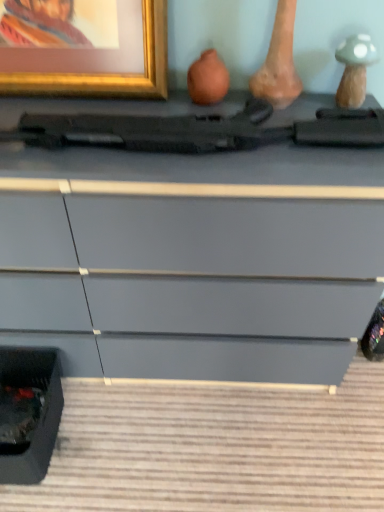
Question: Can you confirm if gold metallic picture frame at upper left is positioned to the right of matte black gun at center?

Choices:
 (A) no
 (B) yes

Answer: (A)

Question: Can you confirm if gold metallic picture frame at upper left is wider than matte black gun at center?

Choices:
 (A) no
 (B) yes

Answer: (A)

Question: Is gold metallic picture frame at upper left placed right next to matte black gun at center?

Choices:
 (A) yes
 (B) no

Answer: (B)

Question: From the image's perspective, would you say gold metallic picture frame at upper left is positioned over matte black gun at center?

Choices:
 (A) no
 (B) yes

Answer: (B)

Question: From the image's perspective, is gold metallic picture frame at upper left below matte black gun at center?

Choices:
 (A) yes
 (B) no

Answer: (B)

Question: From the image's perspective, is matte gray chest of drawers at center positioned above or below gold metallic picture frame at upper left?

Choices:
 (A) below
 (B) above

Answer: (A)

Question: Considering the positions of matte gray chest of drawers at center and gold metallic picture frame at upper left in the image, is matte gray chest of drawers at center bigger or smaller than gold metallic picture frame at upper left?

Choices:
 (A) small
 (B) big

Answer: (B)

Question: Is matte gray chest of drawers at center taller or shorter than gold metallic picture frame at upper left?

Choices:
 (A) tall
 (B) short

Answer: (A)

Question: Choose the correct answer: Is matte gray chest of drawers at center inside gold metallic picture frame at upper left or outside it?

Choices:
 (A) inside
 (B) outside

Answer: (B)

Question: In terms of size, does matte gray chest of drawers at center appear bigger or smaller than matte black gun at center?

Choices:
 (A) small
 (B) big

Answer: (B)

Question: Is point (178, 242) positioned closer to the camera than point (213, 131)?

Choices:
 (A) closer
 (B) farther

Answer: (B)

Question: In the image, is matte gray chest of drawers at center positioned in front of or behind matte black gun at center?

Choices:
 (A) front
 (B) behind

Answer: (A)

Question: From a real-world perspective, relative to matte black gun at center, is matte gray chest of drawers at center vertically above or below?

Choices:
 (A) below
 (B) above

Answer: (A)

Question: Considering the positions of point (26, 44) and point (195, 176), is point (26, 44) closer or farther from the camera than point (195, 176)?

Choices:
 (A) closer
 (B) farther

Answer: (B)

Question: From the image's perspective, relative to matte gray chest of drawers at center, is gold metallic picture frame at upper left above or below?

Choices:
 (A) below
 (B) above

Answer: (B)